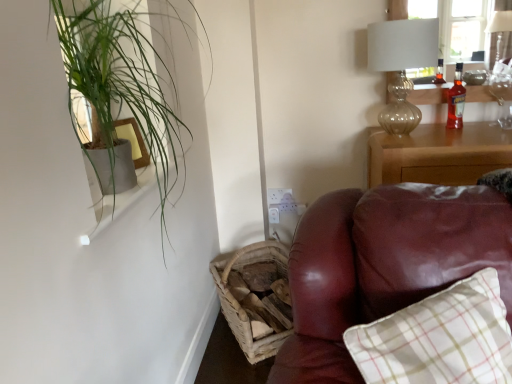
Where is `wooden nightstand at right`? wooden nightstand at right is located at coordinates (438, 154).

Describe the element at coordinates (114, 198) in the screenshot. I see `white glossy window sill at upper left` at that location.

Describe the element at coordinates (239, 304) in the screenshot. I see `woven wood basket at lower left` at that location.

Image resolution: width=512 pixels, height=384 pixels. What are the coordinates of `matte wood picture frame at upper left` in the screenshot? It's located at (133, 140).

At what (x,y) coordinates should I click in order to perform the action: click on wooden nightstand at right. Please return your answer as a coordinate pair (x, y). Looking at the image, I should click on (438, 154).

Can you confirm if leather couch at right is taller than matte wood picture frame at upper left?

Indeed, leather couch at right has a greater height compared to matte wood picture frame at upper left.

Between leather couch at right and matte wood picture frame at upper left, which one has smaller size?

Smaller between the two is matte wood picture frame at upper left.

Is the surface of leather couch at right in direct contact with matte wood picture frame at upper left?

There is a gap between leather couch at right and matte wood picture frame at upper left.

Considering the relative sizes of white glossy window sill at upper left and leather couch at right in the image provided, is white glossy window sill at upper left taller than leather couch at right?

In fact, white glossy window sill at upper left may be shorter than leather couch at right.

Is white glossy window sill at upper left aimed at leather couch at right?

No, white glossy window sill at upper left is not facing towards leather couch at right.

Between white glossy window sill at upper left and leather couch at right, which one has larger size?

leather couch at right.

Which point is more distant from viewer, (x=138, y=191) or (x=390, y=294)?

The point (x=138, y=191) is farther from the camera.

Looking at the image, does wooden nightstand at right seem bigger or smaller compared to matte wood picture frame at upper left?

wooden nightstand at right is bigger than matte wood picture frame at upper left.

Which object is more forward, wooden nightstand at right or matte wood picture frame at upper left?

matte wood picture frame at upper left is closer to the camera.

Between wooden nightstand at right and matte wood picture frame at upper left, which one appears on the right side from the viewer's perspective?

From the viewer's perspective, wooden nightstand at right appears more on the right side.

From the image's perspective, is wooden nightstand at right on matte wood picture frame at upper left?

Incorrect, from the image's perspective, wooden nightstand at right is lower than matte wood picture frame at upper left.

Is green leafy plant at upper left shorter than white glossy window sill at upper left?

In fact, green leafy plant at upper left may be taller than white glossy window sill at upper left.

Where is `window sill located below the green leafy plant at upper left (from the image's perspective)`? The width and height of the screenshot is (512, 384). window sill located below the green leafy plant at upper left (from the image's perspective) is located at coordinates (114, 198).

From the image's perspective, who appears lower, green leafy plant at upper left or white glossy window sill at upper left?

white glossy window sill at upper left appears lower in the image.

From the image's perspective, does woven wood basket at lower left appear lower than leather couch at right?

Yes, from the image's perspective, woven wood basket at lower left is below leather couch at right.

Is woven wood basket at lower left at the left side of leather couch at right?

Correct, you'll find woven wood basket at lower left to the left of leather couch at right.

Based on the photo, is woven wood basket at lower left taller than leather couch at right?

Incorrect, the height of woven wood basket at lower left is not larger of that of leather couch at right.

Is woven wood basket at lower left oriented away from leather couch at right?

That's not correct — woven wood basket at lower left is not looking away from leather couch at right.

Is green leafy plant at upper left oriented towards leather couch at right?

Yes, green leafy plant at upper left is aimed at leather couch at right.

From a real-world perspective, which object rests below the other?

leather couch at right, from a real-world perspective.

Which of these two, green leafy plant at upper left or leather couch at right, stands shorter?

With less height is leather couch at right.

Considering the positions of objects green leafy plant at upper left and leather couch at right in the image provided, who is in front, green leafy plant at upper left or leather couch at right?

Positioned in front is leather couch at right.

Considering the positions of objects wooden nightstand at right and translucent glass table lamp at upper right in the image provided, who is more to the right, wooden nightstand at right or translucent glass table lamp at upper right?

Positioned to the right is wooden nightstand at right.

In the scene shown: Is wooden nightstand at right smaller than translucent glass table lamp at upper right?

No, wooden nightstand at right is not smaller than translucent glass table lamp at upper right.

From the image's perspective, between wooden nightstand at right and translucent glass table lamp at upper right, who is located below?

From the image's view, wooden nightstand at right is below.

Based on the photo, could translucent glass table lamp at upper right be considered to be inside wooden nightstand at right?

No, translucent glass table lamp at upper right is not a part of wooden nightstand at right.

Where is `picture frame behind the leather couch at right`? The width and height of the screenshot is (512, 384). picture frame behind the leather couch at right is located at coordinates (133, 140).

The height and width of the screenshot is (384, 512). Identify the location of studio couch below the white glossy window sill at upper left (from a real-world perspective). (383, 265).

In the scene shown: Estimate the real-world distances between objects in this image. Which object is further from matte wood picture frame at upper left, wooden nightstand at right or translucent amber glass bottle at upper right?

The object further to matte wood picture frame at upper left is translucent amber glass bottle at upper right.

Considering their positions, is wooden nightstand at right positioned further to translucent glass table lamp at upper right than leather couch at right?

leather couch at right is positioned further to the anchor translucent glass table lamp at upper right.

From the image, which object appears to be nearer to green leafy plant at upper left, wooden nightstand at right or translucent amber glass bottle at upper right?

Among the two, wooden nightstand at right is located nearer to green leafy plant at upper left.

From the image, which object appears to be nearer to translucent amber glass bottle at upper right, white glossy window sill at upper left or wooden nightstand at right?

wooden nightstand at right lies closer to translucent amber glass bottle at upper right than the other object.

From the image, which object appears to be farther from matte wood picture frame at upper left, translucent amber glass bottle at upper right or woven wood basket at lower left?

translucent amber glass bottle at upper right is further to matte wood picture frame at upper left.

Looking at the image, which one is located closer to green leafy plant at upper left, matte wood picture frame at upper left or white glossy window sill at upper left?

Among the two, matte wood picture frame at upper left is located nearer to green leafy plant at upper left.

Estimate the real-world distances between objects in this image. Which object is further from green leafy plant at upper left, leather couch at right or wooden nightstand at right?

Among the two, wooden nightstand at right is located further to green leafy plant at upper left.

Considering their positions, is woven wood basket at lower left positioned closer to wooden nightstand at right than translucent glass table lamp at upper right?

Among the two, translucent glass table lamp at upper right is located nearer to wooden nightstand at right.

Image resolution: width=512 pixels, height=384 pixels. I want to click on table lamp between leather couch at right and translucent amber glass bottle at upper right along the z-axis, so click(401, 65).

You are a GUI agent. You are given a task and a screenshot of the screen. Output one action in this format:
    pyautogui.click(x=<x>, y=<y>)
    Task: Click on the houseplant between matte wood picture frame at upper left and leather couch at right
    
    Given the screenshot: What is the action you would take?
    pyautogui.click(x=122, y=89)

Image resolution: width=512 pixels, height=384 pixels. I want to click on basket situated between green leafy plant at upper left and wooden nightstand at right from left to right, so click(x=239, y=304).

This screenshot has width=512, height=384. I want to click on nightstand between leather couch at right and translucent amber glass bottle at upper right along the z-axis, so click(438, 154).